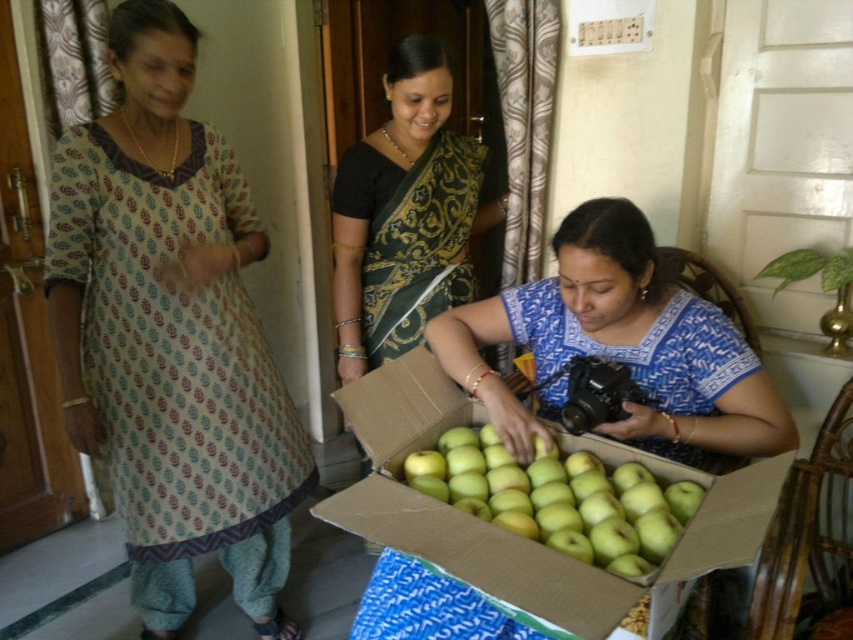
Can you confirm if printed cotton kurta at left is taller than matte blue blouse at center?

Indeed, printed cotton kurta at left has a greater height compared to matte blue blouse at center.

Between printed cotton kurta at left and matte blue blouse at center, which one is positioned lower?

Positioned lower is matte blue blouse at center.

At what (x,y) coordinates should I click in order to perform the action: click on printed cotton kurta at left. Please return your answer as a coordinate pair (x, y). This screenshot has width=853, height=640. Looking at the image, I should click on (171, 336).

Between printed cotton kurta at left and green silk saree at center, which one is positioned higher?

green silk saree at center is above.

Between point (212, 275) and point (364, 364), which one is positioned in front?

Point (212, 275) is in front.

Between point (231, 232) and point (460, 172), which one is positioned behind?

The point (460, 172) is more distant.

Identify the location of printed cotton kurta at left. The height and width of the screenshot is (640, 853). click(x=171, y=336).

Who is positioned more to the left, green matte cardboard box at lower center or green matte apples at center?

green matte cardboard box at lower center is more to the left.

Does green matte cardboard box at lower center have a larger size compared to green matte apples at center?

Yes, green matte cardboard box at lower center is bigger than green matte apples at center.

Locate an element on the screen. The width and height of the screenshot is (853, 640). green matte cardboard box at lower center is located at coordinates (515, 534).

I want to click on green matte cardboard box at lower center, so click(x=515, y=534).